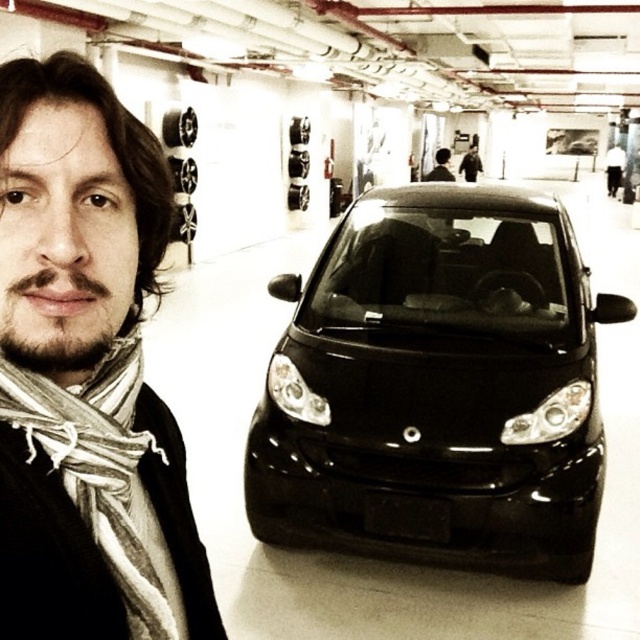
Question: Can you confirm if glossy black car at center is positioned to the right of matte scarf at left?

Choices:
 (A) no
 (B) yes

Answer: (B)

Question: Which point is farther to the camera?

Choices:
 (A) matte black car at center
 (B) matte scarf at left

Answer: (A)

Question: Does white striped scarf at left appear on the right side of matte black car at center?

Choices:
 (A) yes
 (B) no

Answer: (B)

Question: Which point is closer to the camera?

Choices:
 (A) (280, 436)
 (B) (428, 176)

Answer: (A)

Question: Estimate the real-world distances between objects in this image. Which object is closer to the matte black car at center?

Choices:
 (A) glossy black car at center
 (B) white striped scarf at left
 (C) matte scarf at left

Answer: (A)

Question: Is matte scarf at left further to camera compared to white striped scarf at left?

Choices:
 (A) yes
 (B) no

Answer: (B)